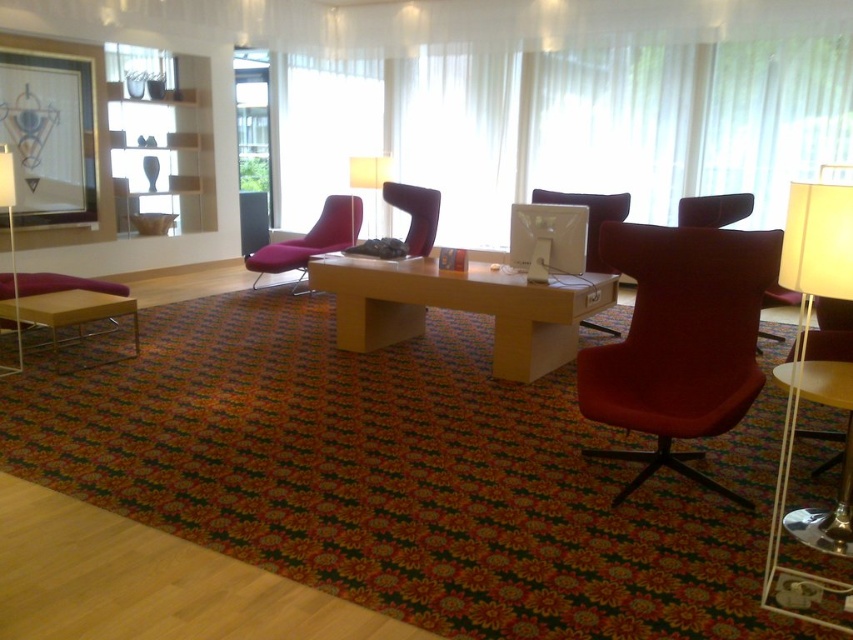
You are standing in the room and want to pick up a pen from the wooden coffee table at lower left. To reach it, you need to walk around the velvet red chair at center. Which direction should you move first to avoid bumping into the chair?

Since the wooden coffee table at lower left is closer to the viewer than the velvet red chair at center, you should move to the side opposite the chair to avoid it. However, without knowing the exact arrangement of the chairs around the table, it is difficult to determine the specific direction. Please check the layout again.

You are designing a layout for a new art installation and need to place two items in a gallery. You have a matte black picture frame at upper left and a matte white lampshade at center. Given their sizes, which object should you choose if you need an item with greater width for the main display area?

The matte black picture frame at upper left should be chosen for the main display area because its width surpasses that of the matte white lampshade at center.

What are the coordinates of the matte black picture frame at upper left?

The coordinates of the matte black picture frame at upper left are at point [55,134].